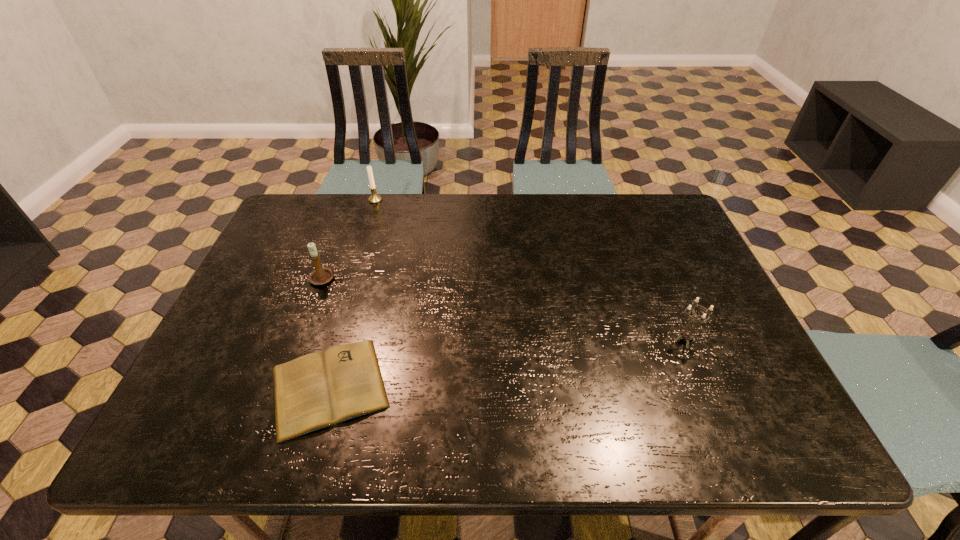
Locate an element on the screen. The image size is (960, 540). object that is the third nearest to the leftmost candle holder is located at coordinates (685, 335).

You are a GUI agent. You are given a task and a screenshot of the screen. Output one action in this format:
    pyautogui.click(x=<x>, y=<y>)
    Task: Click on the third closest object to the second farthest object
    
    Given the screenshot: What is the action you would take?
    pyautogui.click(x=685, y=335)

This screenshot has height=540, width=960. Identify the location of the closest candle holder relative to the farthest object. (320, 276).

In order to click on the closest candle holder relative to the farthest object in this screenshot , I will do `click(320, 276)`.

This screenshot has width=960, height=540. I want to click on vacant space that satisfies the following two spatial constraints: 1. on the front side of the rightmost object; 2. on the right side of the farthest object, so click(x=333, y=340).

Identify the location of free location that satisfies the following two spatial constraints: 1. on the front side of the farthest object; 2. on the left side of the shortest object. (320, 387).

Where is `free spot that satisfies the following two spatial constraints: 1. on the side of the book with the handle; 2. on the left side of the third nearest object`? The image size is (960, 540). free spot that satisfies the following two spatial constraints: 1. on the side of the book with the handle; 2. on the left side of the third nearest object is located at coordinates (286, 387).

I want to click on vacant space that satisfies the following two spatial constraints: 1. on the back side of the shortest object; 2. on the side of the second farthest object with the handle, so click(x=360, y=279).

Locate an element on the screen. free region that satisfies the following two spatial constraints: 1. on the side of the leftmost candle holder with the handle; 2. on the left side of the rightmost candle holder is located at coordinates (303, 340).